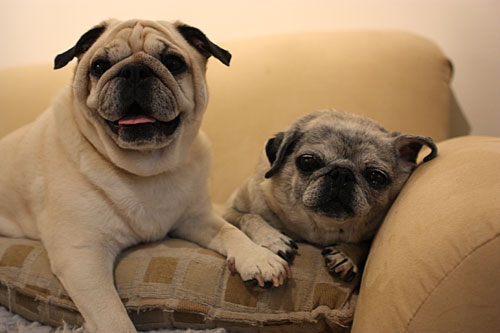
In order to click on couch to right of dog in this screenshot , I will do `click(400, 202)`.